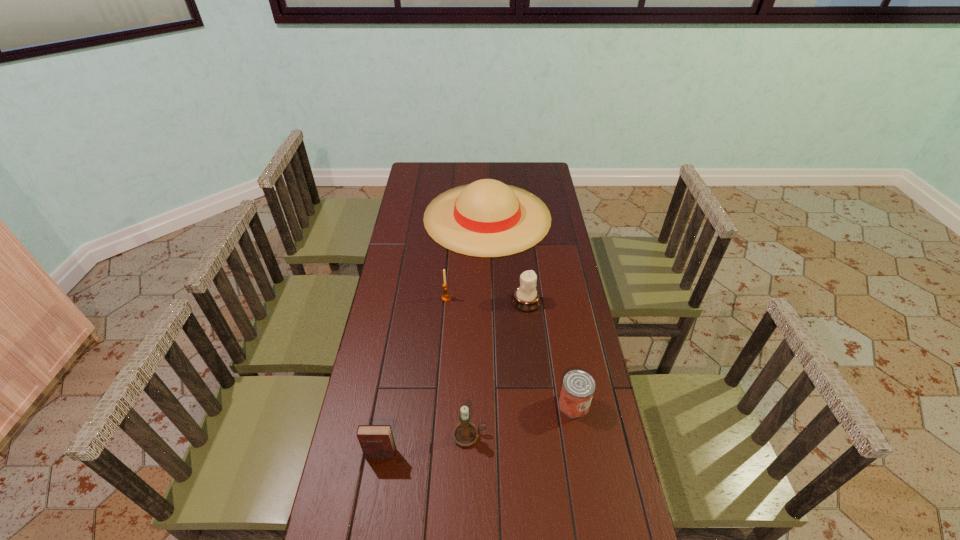
Identify the location of vacant space in between the can and the leftmost candle holder. (510, 351).

I want to click on unoccupied position between the farthest object and the second candle holder from right to left, so click(x=478, y=326).

This screenshot has height=540, width=960. I want to click on unoccupied position between the third nearest object and the leftmost candle holder, so click(510, 351).

You are a GUI agent. You are given a task and a screenshot of the screen. Output one action in this format:
    pyautogui.click(x=<x>, y=<y>)
    Task: Click on the free space between the nearest candle holder and the sombrero
    The image size is (960, 540).
    Given the screenshot: What is the action you would take?
    pyautogui.click(x=478, y=326)

You are a GUI agent. You are given a task and a screenshot of the screen. Output one action in this format:
    pyautogui.click(x=<x>, y=<y>)
    Task: Click on the vacant space that is in between the leftmost candle holder and the rightmost candle holder
    
    Given the screenshot: What is the action you would take?
    pyautogui.click(x=486, y=300)

Locate an element on the screen. The height and width of the screenshot is (540, 960). vacant space that is in between the nearest object and the rightmost candle holder is located at coordinates (453, 377).

The width and height of the screenshot is (960, 540). I want to click on empty space that is in between the leftmost candle holder and the shortest object, so click(x=510, y=351).

Where is `object that is the closest to the farthest object`? object that is the closest to the farthest object is located at coordinates (526, 298).

Where is `object that is the fifth closest to the rightmost candle holder`? Image resolution: width=960 pixels, height=540 pixels. object that is the fifth closest to the rightmost candle holder is located at coordinates (377, 442).

Identify which candle holder is located as the nearest to the rightmost candle holder. Please provide its 2D coordinates. Your answer should be formatted as a tuple, i.e. [(x, y)], where the tuple contains the x and y coordinates of a point satisfying the conditions above.

[(445, 297)]